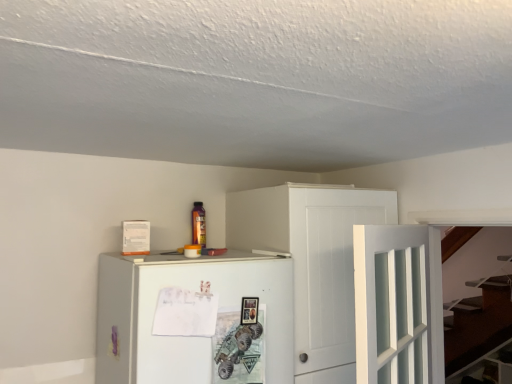
Question: Is white glass door at center-right facing away from white wood cabinet at upper center?

Choices:
 (A) no
 (B) yes

Answer: (B)

Question: From a real-world perspective, is white glass door at center-right positioned over white wood cabinet at upper center based on gravity?

Choices:
 (A) no
 (B) yes

Answer: (B)

Question: Does white glass door at center-right come behind white wood cabinet at upper center?

Choices:
 (A) yes
 (B) no

Answer: (B)

Question: Is white glass door at center-right outside of white wood cabinet at upper center?

Choices:
 (A) yes
 (B) no

Answer: (A)

Question: Is white glass door at center-right to the right of white wood cabinet at upper center from the viewer's perspective?

Choices:
 (A) no
 (B) yes

Answer: (B)

Question: Visually, is white glass door at center-right positioned to the left or to the right of white wood cabinet at upper center?

Choices:
 (A) left
 (B) right

Answer: (B)

Question: In terms of width, does white glass door at center-right look wider or thinner when compared to white wood cabinet at upper center?

Choices:
 (A) thin
 (B) wide

Answer: (A)

Question: Considering the positions of white glass door at center-right and white wood cabinet at upper center in the image, is white glass door at center-right bigger or smaller than white wood cabinet at upper center?

Choices:
 (A) big
 (B) small

Answer: (B)

Question: From the image's perspective, relative to white wood cabinet at upper center, is white glass door at center-right above or below?

Choices:
 (A) below
 (B) above

Answer: (B)

Question: From the image's perspective, is white matte refrigerator at center positioned above or below white wood cabinet at upper center?

Choices:
 (A) above
 (B) below

Answer: (B)

Question: Considering their positions, is white matte refrigerator at center located in front of or behind white wood cabinet at upper center?

Choices:
 (A) behind
 (B) front

Answer: (B)

Question: From their relative heights in the image, would you say white matte refrigerator at center is taller or shorter than white wood cabinet at upper center?

Choices:
 (A) short
 (B) tall

Answer: (A)

Question: Is white matte refrigerator at center wider or thinner than white wood cabinet at upper center?

Choices:
 (A) wide
 (B) thin

Answer: (A)

Question: From a real-world perspective, is white matte refrigerator at center physically located above or below white glass door at center-right?

Choices:
 (A) below
 (B) above

Answer: (A)

Question: Is white matte refrigerator at center wider or thinner than white glass door at center-right?

Choices:
 (A) wide
 (B) thin

Answer: (A)